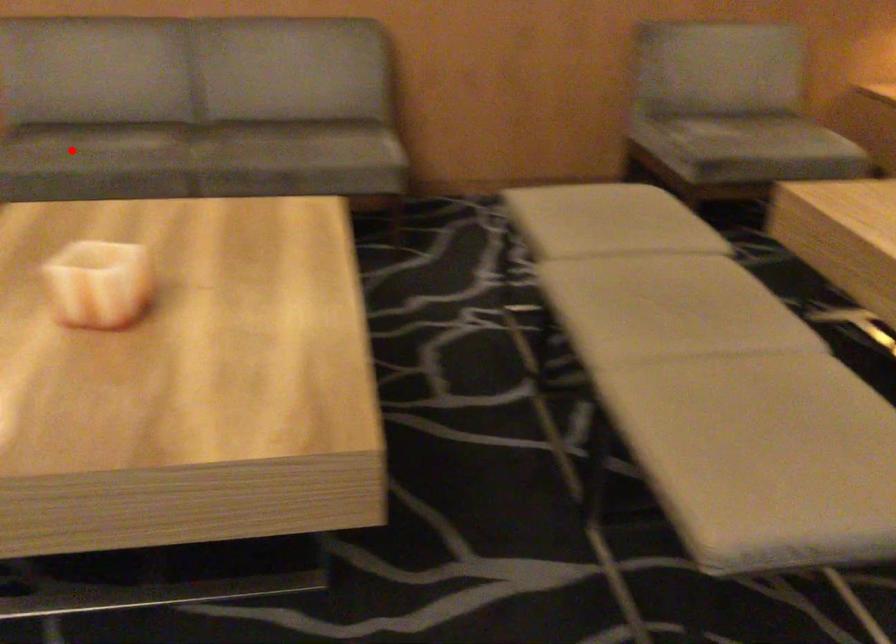
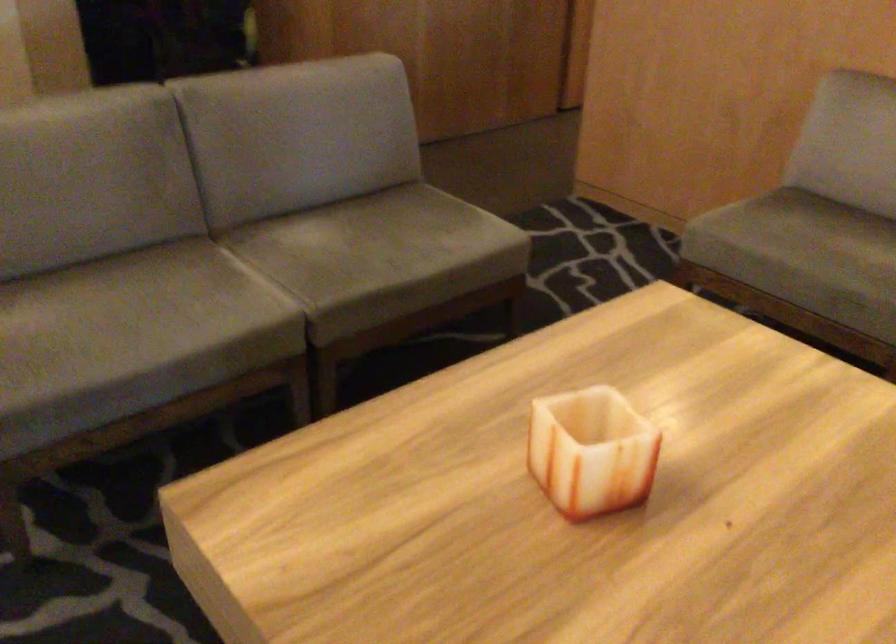
Question: A red point is marked in image1. In image2, is the corresponding 3D point closer to the camera or farther? Reply with the corresponding letter.

Choices:
 (A) The corresponding 3D point is closer.
 (B) The corresponding 3D point is farther.

Answer: (A)